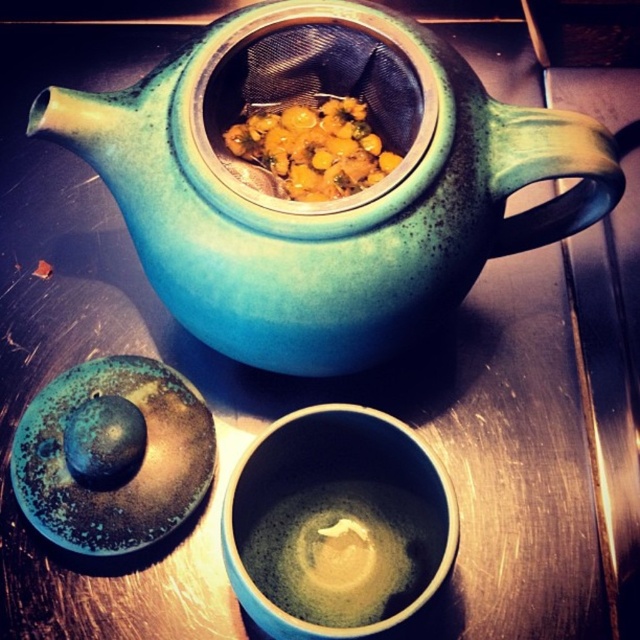
You are a robotic arm trying to pick up an object from the wooden surface. There are two points marked on the image where objects might be placed. The first point is at coordinate point (605, 164) and the second is at coordinate point (387, 522). Which point should you target first if you want to pick up the object that is closer to you?

Point (605, 164) is in front of point (387, 522), so you should target point (605, 164) first since it is closer to you.